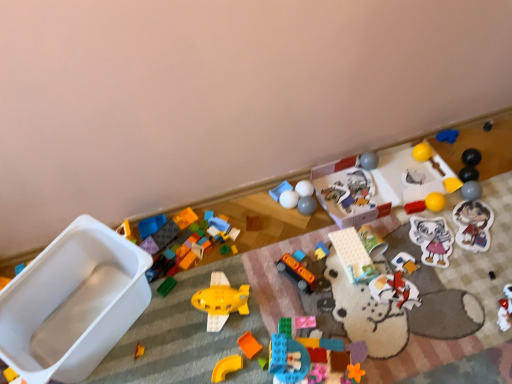
Find the location of a particular element. Image resolution: width=512 pixels, height=384 pixels. vacant space to the right of white matte figure at center, the nineteenth toy viewed from the left is located at coordinates (450, 275).